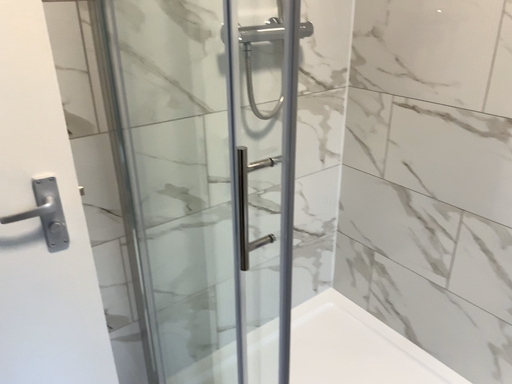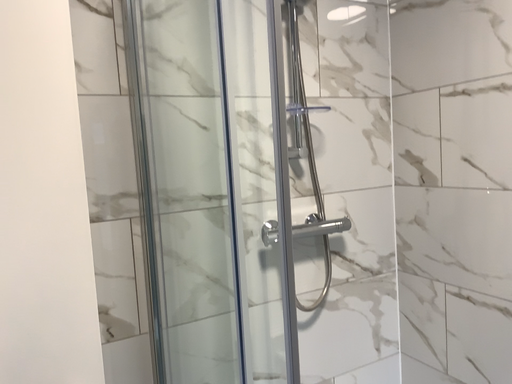
Question: How did the camera likely rotate when shooting the video?

Choices:
 (A) rotated left
 (B) rotated right

Answer: (A)